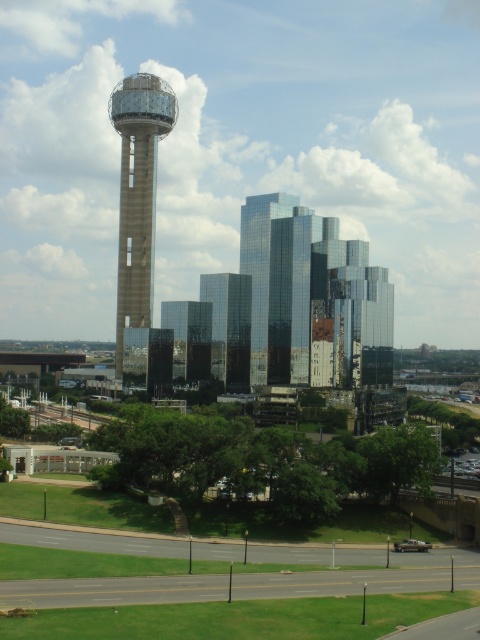
Question: Which point is farther from the camera taking this photo?

Choices:
 (A) (219, 307)
 (B) (265, 337)

Answer: (A)

Question: Can you confirm if stone tower at center is smaller than glassy reflective skyscraper at center?

Choices:
 (A) yes
 (B) no

Answer: (B)

Question: Which of these objects is positioned farthest from the shiny glass skyscraper at center?

Choices:
 (A) stone tower at center
 (B) glassy reflective skyscraper at center

Answer: (A)

Question: Which of the following is the farthest from the observer?

Choices:
 (A) (117, 355)
 (B) (235, 326)

Answer: (A)

Question: Does stone tower at center appear under glassy reflective skyscraper at center?

Choices:
 (A) no
 (B) yes

Answer: (A)

Question: Can you confirm if shiny glass skyscraper at center is thinner than glassy reflective skyscraper at center?

Choices:
 (A) no
 (B) yes

Answer: (A)